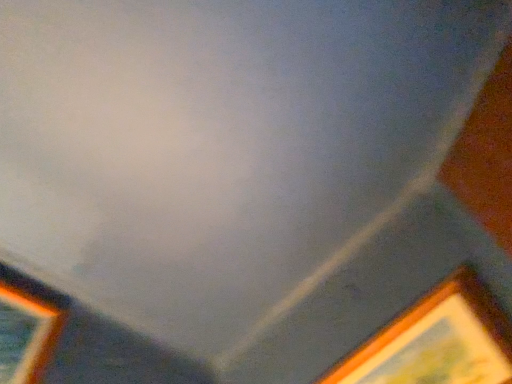
Where is `wooden picture frame at lower right`? The image size is (512, 384). wooden picture frame at lower right is located at coordinates (x=437, y=341).

Measure the distance between point [464,360] and camera.

Point [464,360] and camera are 75.10 centimeters apart.

Describe the element at coordinates (437, 341) in the screenshot. This screenshot has width=512, height=384. I see `wooden picture frame at lower right` at that location.

Find the location of a particular element. This screenshot has width=512, height=384. wooden picture frame at lower right is located at coordinates (437, 341).